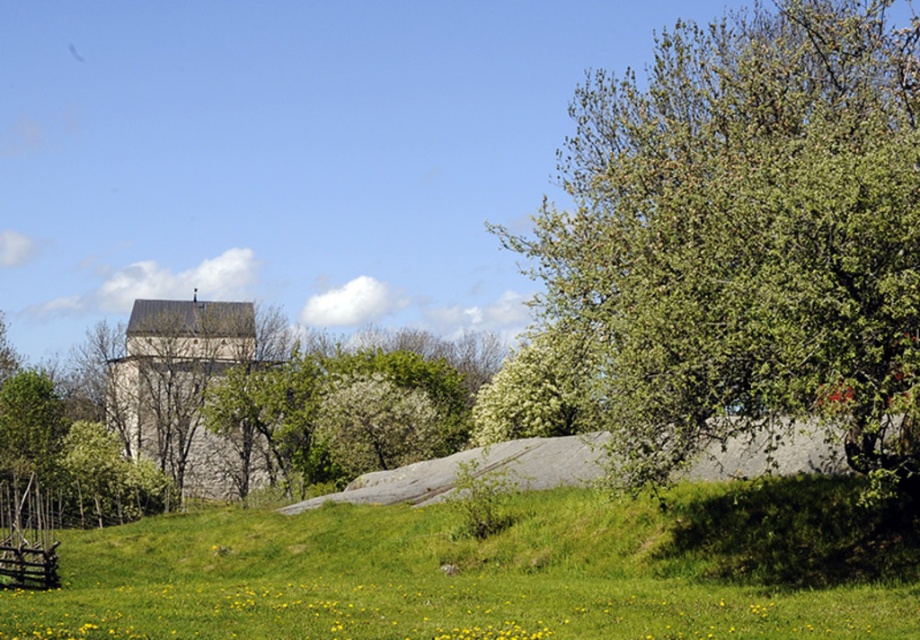
The image size is (920, 640). What do you see at coordinates (746, 236) in the screenshot?
I see `green leafy tree at right` at bounding box center [746, 236].

Does green leafy tree at right appear under gray stone church at center?

Actually, green leafy tree at right is above gray stone church at center.

This screenshot has height=640, width=920. What are the coordinates of `green leafy tree at right` in the screenshot? It's located at (746, 236).

At what (x,y) coordinates should I click in order to perform the action: click on green leafy tree at right. Please return your answer as a coordinate pair (x, y). Image resolution: width=920 pixels, height=640 pixels. Looking at the image, I should click on (746, 236).

Which is above, gray stone church at center or brown wooden fence at lower left?

gray stone church at center

Identify the location of gray stone church at center. (185, 394).

Between point (167, 356) and point (46, 580), which one is positioned in front?

Point (46, 580) is in front.

What are the coordinates of `gray stone church at center` in the screenshot? It's located at (185, 394).

Is green leafy tree at right above green grassy hill at lower center?

Yes, green leafy tree at right is above green grassy hill at lower center.

Which is behind, point (898, 51) or point (776, 605)?

The point (898, 51) is more distant.

Where is `green leafy tree at right`? green leafy tree at right is located at coordinates 746,236.